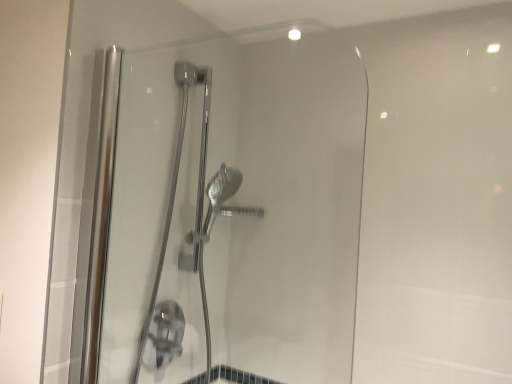
Image resolution: width=512 pixels, height=384 pixels. What do you see at coordinates (177, 179) in the screenshot? I see `chrome metallic shower door at center, the 2th shower door viewed from the front` at bounding box center [177, 179].

In order to click on chrome metallic shower door at center, the 2th shower door viewed from the front in this screenshot , I will do `click(177, 179)`.

What is the approximate height of chrome metallic shower door at center, the 2th shower door viewed from the front?

It is 1.08 meters.

In order to click on clear glass shower door at center, the second shower door in the back-to-front sequence in this screenshot , I will do `click(228, 212)`.

The width and height of the screenshot is (512, 384). What do you see at coordinates (228, 212) in the screenshot?
I see `clear glass shower door at center, positioned as the first shower door in front-to-back order` at bounding box center [228, 212].

Where is `chrome metallic shower door at center, which is the 1th shower door in back-to-front order`? The width and height of the screenshot is (512, 384). chrome metallic shower door at center, which is the 1th shower door in back-to-front order is located at coordinates (177, 179).

In the image, is clear glass shower door at center, positioned as the first shower door in front-to-back order, on the left side or the right side of chrome metallic shower door at center, which is the 1th shower door in back-to-front order?

Clearly, clear glass shower door at center, positioned as the first shower door in front-to-back order, is on the right of chrome metallic shower door at center, which is the 1th shower door in back-to-front order, in the image.

Considering their positions, is clear glass shower door at center, the second shower door in the back-to-front sequence, located in front of or behind chrome metallic shower door at center, the 2th shower door viewed from the front?

clear glass shower door at center, the second shower door in the back-to-front sequence, is positioned closer to the viewer than chrome metallic shower door at center, the 2th shower door viewed from the front.

Is point (362, 172) in front of point (186, 102)?

Yes.

Looking at this image, from the image's perspective, does clear glass shower door at center, the second shower door in the back-to-front sequence, appear lower than chrome metallic shower door at center, the 2th shower door viewed from the front?

No, from the image's perspective, clear glass shower door at center, the second shower door in the back-to-front sequence, is not below chrome metallic shower door at center, the 2th shower door viewed from the front.

In the scene shown: From a real-world perspective, between clear glass shower door at center, the second shower door in the back-to-front sequence, and chrome metallic shower door at center, the 2th shower door viewed from the front, who is vertically lower?

chrome metallic shower door at center, the 2th shower door viewed from the front.

Which of these two, clear glass shower door at center, positioned as the first shower door in front-to-back order, or chrome metallic shower door at center, which is the 1th shower door in back-to-front order, is wider?

Wider between the two is chrome metallic shower door at center, which is the 1th shower door in back-to-front order.

In terms of height, does clear glass shower door at center, the second shower door in the back-to-front sequence, look taller or shorter compared to chrome metallic shower door at center, the 2th shower door viewed from the front?

Considering their sizes, clear glass shower door at center, the second shower door in the back-to-front sequence, has less height than chrome metallic shower door at center, the 2th shower door viewed from the front.

Considering the sizes of clear glass shower door at center, the second shower door in the back-to-front sequence, and chrome metallic shower door at center, which is the 1th shower door in back-to-front order, in the image, is clear glass shower door at center, the second shower door in the back-to-front sequence, bigger or smaller than chrome metallic shower door at center, which is the 1th shower door in back-to-front order,?

clear glass shower door at center, the second shower door in the back-to-front sequence, is smaller than chrome metallic shower door at center, which is the 1th shower door in back-to-front order.

Consider the image. Is clear glass shower door at center, the second shower door in the back-to-front sequence, surrounding chrome metallic shower door at center, which is the 1th shower door in back-to-front order?

No, chrome metallic shower door at center, which is the 1th shower door in back-to-front order, is not inside clear glass shower door at center, the second shower door in the back-to-front sequence.

Is clear glass shower door at center, positioned as the first shower door in front-to-back order, beside chrome metallic shower door at center, the 2th shower door viewed from the front?

No, clear glass shower door at center, positioned as the first shower door in front-to-back order, is not touching chrome metallic shower door at center, the 2th shower door viewed from the front.

Is clear glass shower door at center, positioned as the first shower door in front-to-back order, positioned with its back to chrome metallic shower door at center, which is the 1th shower door in back-to-front order?

That's right, clear glass shower door at center, positioned as the first shower door in front-to-back order, is facing away from chrome metallic shower door at center, which is the 1th shower door in back-to-front order.

In the scene shown: What's the angular difference between clear glass shower door at center, the second shower door in the back-to-front sequence, and chrome metallic shower door at center, the 2th shower door viewed from the front,'s facing directions?

They differ by 90 degrees in their facing directions.

Measure the distance from clear glass shower door at center, positioned as the first shower door in front-to-back order, to chrome metallic shower door at center, which is the 1th shower door in back-to-front order.

18.10 centimeters.

Locate an element on the screen. The width and height of the screenshot is (512, 384). shower door behind the clear glass shower door at center, the second shower door in the back-to-front sequence is located at coordinates (177, 179).

Does chrome metallic shower door at center, which is the 1th shower door in back-to-front order, appear on the left side of clear glass shower door at center, positioned as the first shower door in front-to-back order?

Yes, chrome metallic shower door at center, which is the 1th shower door in back-to-front order, is to the left of clear glass shower door at center, positioned as the first shower door in front-to-back order.

Considering their positions, is chrome metallic shower door at center, the 2th shower door viewed from the front, located in front of or behind clear glass shower door at center, the second shower door in the back-to-front sequence?

In the image, chrome metallic shower door at center, the 2th shower door viewed from the front, appears behind clear glass shower door at center, the second shower door in the back-to-front sequence.

Considering the points (200, 83) and (310, 35), which point is behind, point (200, 83) or point (310, 35)?

The point (310, 35) is farther from the camera.

From the image's perspective, is chrome metallic shower door at center, which is the 1th shower door in back-to-front order, on top of clear glass shower door at center, the second shower door in the back-to-front sequence?

Actually, chrome metallic shower door at center, which is the 1th shower door in back-to-front order, appears below clear glass shower door at center, the second shower door in the back-to-front sequence, in the image.

From a real-world perspective, is chrome metallic shower door at center, the 2th shower door viewed from the front, below clear glass shower door at center, positioned as the first shower door in front-to-back order?

Yes.

Which of these two, chrome metallic shower door at center, which is the 1th shower door in back-to-front order, or clear glass shower door at center, positioned as the first shower door in front-to-back order, is thinner?

clear glass shower door at center, positioned as the first shower door in front-to-back order.

Considering the sizes of objects chrome metallic shower door at center, which is the 1th shower door in back-to-front order, and clear glass shower door at center, positioned as the first shower door in front-to-back order, in the image provided, who is taller, chrome metallic shower door at center, which is the 1th shower door in back-to-front order, or clear glass shower door at center, positioned as the first shower door in front-to-back order,?

chrome metallic shower door at center, which is the 1th shower door in back-to-front order, is taller.

Is chrome metallic shower door at center, which is the 1th shower door in back-to-front order, smaller than clear glass shower door at center, the second shower door in the back-to-front sequence?

No.

Is chrome metallic shower door at center, which is the 1th shower door in back-to-front order, spatially inside clear glass shower door at center, positioned as the first shower door in front-to-back order, or outside of it?

chrome metallic shower door at center, which is the 1th shower door in back-to-front order, lies outside clear glass shower door at center, positioned as the first shower door in front-to-back order.

Is chrome metallic shower door at center, the 2th shower door viewed from the front, far from clear glass shower door at center, the second shower door in the back-to-front sequence?

No, chrome metallic shower door at center, the 2th shower door viewed from the front, is not far away from clear glass shower door at center, the second shower door in the back-to-front sequence.

Is chrome metallic shower door at center, which is the 1th shower door in back-to-front order, oriented away from clear glass shower door at center, positioned as the first shower door in front-to-back order?

chrome metallic shower door at center, which is the 1th shower door in back-to-front order, is not turned away from clear glass shower door at center, positioned as the first shower door in front-to-back order.

Identify the location of shower door on the right of chrome metallic shower door at center, the 2th shower door viewed from the front. The width and height of the screenshot is (512, 384). (228, 212).

Identify the location of shower door located on the right of chrome metallic shower door at center, the 2th shower door viewed from the front. (228, 212).

Image resolution: width=512 pixels, height=384 pixels. In the image, there is a clear glass shower door at center, positioned as the first shower door in front-to-back order. Find the location of `shower door below it (from the image's perspective)`. shower door below it (from the image's perspective) is located at coordinates (177, 179).